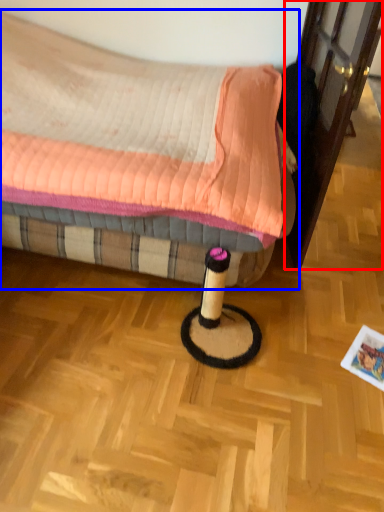
Question: Among these objects, which one is farthest to the camera, screen door (highlighted by a red box) or bed (highlighted by a blue box)?

Choices:
 (A) screen door
 (B) bed

Answer: (A)